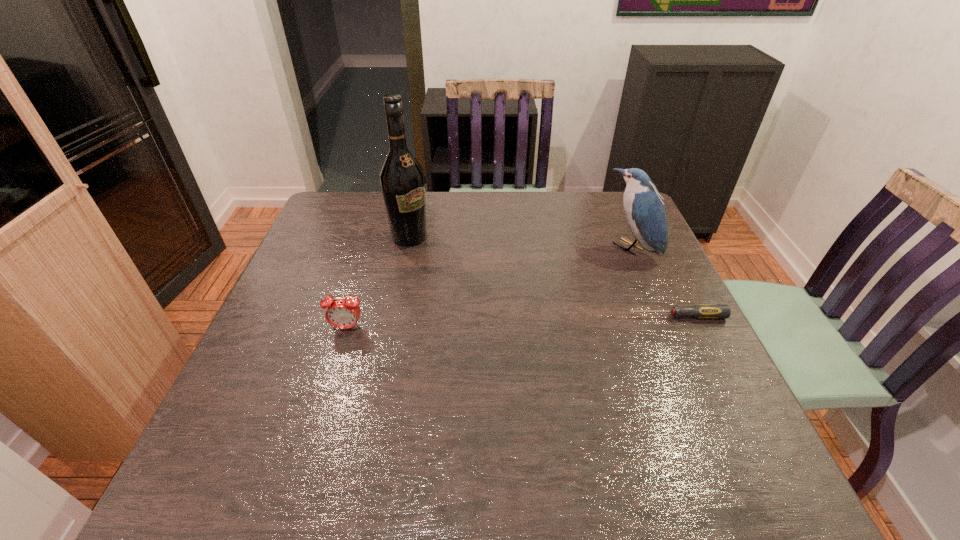
The width and height of the screenshot is (960, 540). I want to click on empty location between the screwdriver and the tallest object, so click(542, 277).

At what (x,y) coordinates should I click in order to perform the action: click on free point between the bird and the third tallest object. Please return your answer as a coordinate pair (x, y). The height and width of the screenshot is (540, 960). Looking at the image, I should click on (489, 288).

Identify the location of free spot between the second nearest object and the nearest object. The height and width of the screenshot is (540, 960). (512, 322).

Find the location of a particular element. free space between the third shortest object and the tallest object is located at coordinates (520, 242).

Identify the location of free space that is in between the screwdriver and the second shortest object. (x=512, y=322).

This screenshot has height=540, width=960. Find the location of `free spot between the third shortest object and the third tallest object`. free spot between the third shortest object and the third tallest object is located at coordinates (489, 288).

Locate an element on the screen. The width and height of the screenshot is (960, 540). empty space that is in between the tallest object and the second nearest object is located at coordinates (542, 277).

Find the location of a particular element. free area in between the bird and the second nearest object is located at coordinates (654, 282).

I want to click on the third closest object relative to the screwdriver, so click(341, 313).

You are a GUI agent. You are given a task and a screenshot of the screen. Output one action in this format:
    pyautogui.click(x=<x>, y=<y>)
    Task: Click on the closest object to the third farthest object
    
    Given the screenshot: What is the action you would take?
    pyautogui.click(x=644, y=209)